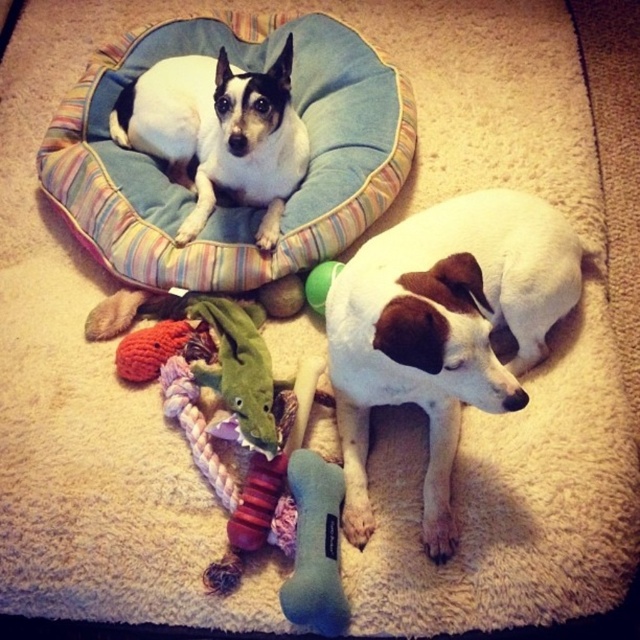
Which is above, white soft fur dog at lower center or green rubber ball at center?

green rubber ball at center is higher up.

Does white soft fur dog at lower center have a greater width compared to green rubber ball at center?

Correct, the width of white soft fur dog at lower center exceeds that of green rubber ball at center.

Which is behind, point (481, 352) or point (317, 298)?

Positioned behind is point (317, 298).

At what (x,y) coordinates should I click in order to perform the action: click on white soft fur dog at lower center. Please return your answer as a coordinate pair (x, y). Image resolution: width=640 pixels, height=640 pixels. Looking at the image, I should click on (444, 330).

Is white soft dog at upper left smaller than green rubber ball at center?

Incorrect, white soft dog at upper left is not smaller in size than green rubber ball at center.

I want to click on white soft dog at upper left, so click(x=218, y=132).

Between point (177, 241) and point (317, 268), which one is positioned behind?

The point (177, 241) is behind.

Identify the location of white soft dog at upper left. The width and height of the screenshot is (640, 640). (218, 132).

Who is taller, blue fabric dog bed at upper left or green rubber ball at center?

Standing taller between the two is blue fabric dog bed at upper left.

Who is higher up, blue fabric dog bed at upper left or green rubber ball at center?

Positioned higher is blue fabric dog bed at upper left.

At what (x,y) coordinates should I click in order to perform the action: click on blue fabric dog bed at upper left. Please return your answer as a coordinate pair (x, y). Looking at the image, I should click on coord(225,195).

Identify the location of blue fabric dog bed at upper left. The width and height of the screenshot is (640, 640). [x=225, y=195].